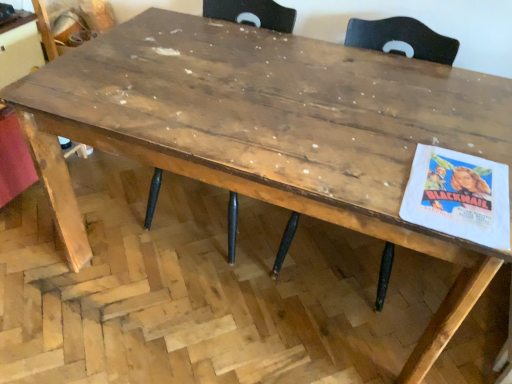
Question: Is wooden chair at center, which appears as the 2th chair when viewed from the left, inside the boundaries of wooden chair at center, which ranks as the 1th chair in left-to-right order, or outside?

Choices:
 (A) inside
 (B) outside

Answer: (B)

Question: From a real-world perspective, is wooden chair at center, which is the 1th chair from right to left, positioned above or below wooden chair at center, which ranks as the 1th chair in left-to-right order?

Choices:
 (A) above
 (B) below

Answer: (A)

Question: Based on their positions, is wooden chair at center, which is the 1th chair from right to left, located to the left or right of wooden chair at center, marked as the 2th chair in a right-to-left arrangement?

Choices:
 (A) left
 (B) right

Answer: (B)

Question: From the image's perspective, relative to wooden chair at center, which is the 1th chair from right to left, is wooden chair at center, marked as the 2th chair in a right-to-left arrangement, above or below?

Choices:
 (A) below
 (B) above

Answer: (B)

Question: Looking at their shapes, would you say wooden chair at center, which ranks as the 1th chair in left-to-right order, is wider or thinner than wooden chair at center, which is the 1th chair from right to left?

Choices:
 (A) wide
 (B) thin

Answer: (A)

Question: Is wooden chair at center, marked as the 2th chair in a right-to-left arrangement, situated inside wooden chair at center, which appears as the 2th chair when viewed from the left, or outside?

Choices:
 (A) inside
 (B) outside

Answer: (B)

Question: Is wooden chair at center, marked as the 2th chair in a right-to-left arrangement, bigger or smaller than wooden chair at center, which is the 1th chair from right to left?

Choices:
 (A) big
 (B) small

Answer: (A)